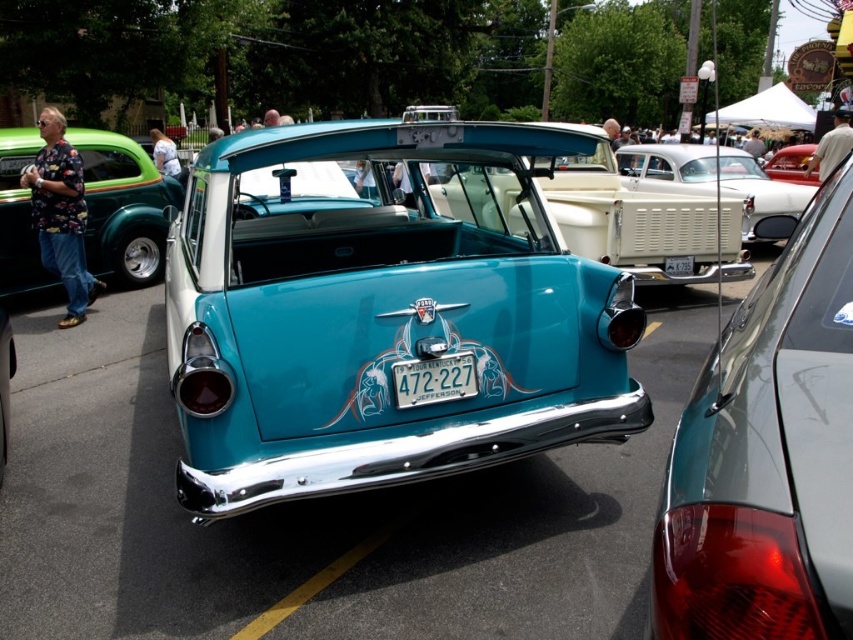
Looking at this image, does glossy metallic car at right appear on the right side of blue metallic license plate at center?

Yes, glossy metallic car at right is to the right of blue metallic license plate at center.

Which is more to the right, glossy metallic car at right or blue metallic license plate at center?

From the viewer's perspective, glossy metallic car at right appears more on the right side.

Locate an element on the screen. The image size is (853, 640). glossy metallic car at right is located at coordinates (767, 452).

Describe the element at coordinates (381, 312) in the screenshot. The height and width of the screenshot is (640, 853). I see `glossy teal car at center` at that location.

Is the position of glossy teal car at center less distant than that of blue metallic license plate at center?

Yes, it is.

Where is `glossy teal car at center`? The image size is (853, 640). glossy teal car at center is located at coordinates (381, 312).

In the scene shown: Is glossy metallic car at right below white glossy pickup truck at center?

Correct, glossy metallic car at right is located below white glossy pickup truck at center.

Does glossy metallic car at right have a greater height compared to white glossy pickup truck at center?

Incorrect, glossy metallic car at right's height is not larger of white glossy pickup truck at center's.

Locate an element on the screen. glossy metallic car at right is located at coordinates (767, 452).

Find the location of a particular element. The image size is (853, 640). glossy metallic car at right is located at coordinates (767, 452).